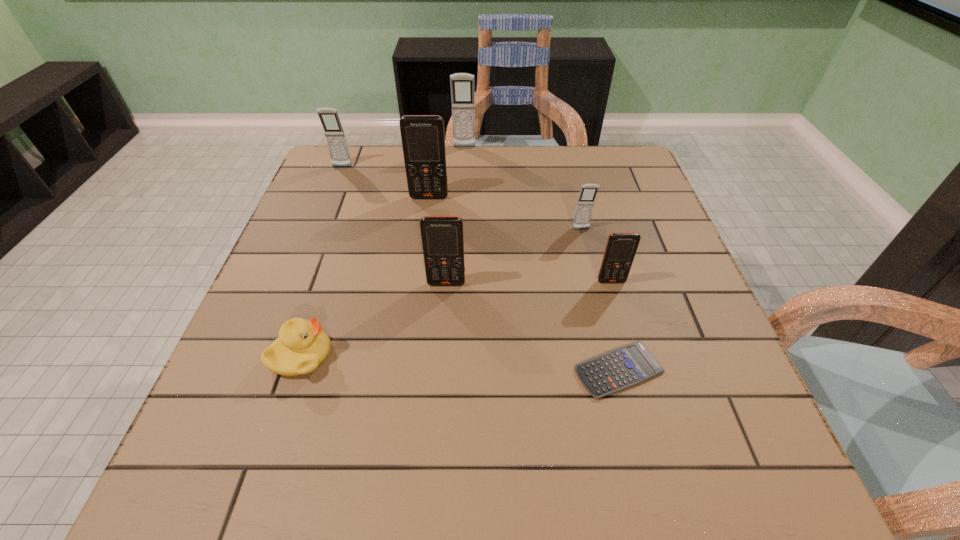
Identify which orange cellular telephone is the second nearest to the second biggest orange cellular telephone. Please provide its 2D coordinates. Your answer should be formatted as a tuple, i.e. [(x, y)], where the tuple contains the x and y coordinates of a point satisfying the conditions above.

[(423, 140)]

This screenshot has width=960, height=540. I want to click on free location that satisfies the following two spatial constraints: 1. on the front-facing side of the second gray cellular telephone from left to right; 2. on the right side of the calculator, so click(x=453, y=370).

This screenshot has width=960, height=540. What are the coordinates of `free region that satisfies the following two spatial constraints: 1. on the screen of the rightmost orange cellular telephone; 2. on the beak of the duckling` in the screenshot? It's located at (633, 356).

This screenshot has height=540, width=960. I want to click on free space in the image that satisfies the following two spatial constraints: 1. on the screen of the biggest orange cellular telephone; 2. on the beak of the seventh tallest object, so click(408, 356).

At what (x,y) coordinates should I click in order to perform the action: click on vacant space that satisfies the following two spatial constraints: 1. on the front-facing side of the rightmost gray cellular telephone; 2. on the beak of the duckling. Please return your answer as a coordinate pair (x, y). Looking at the image, I should click on (612, 356).